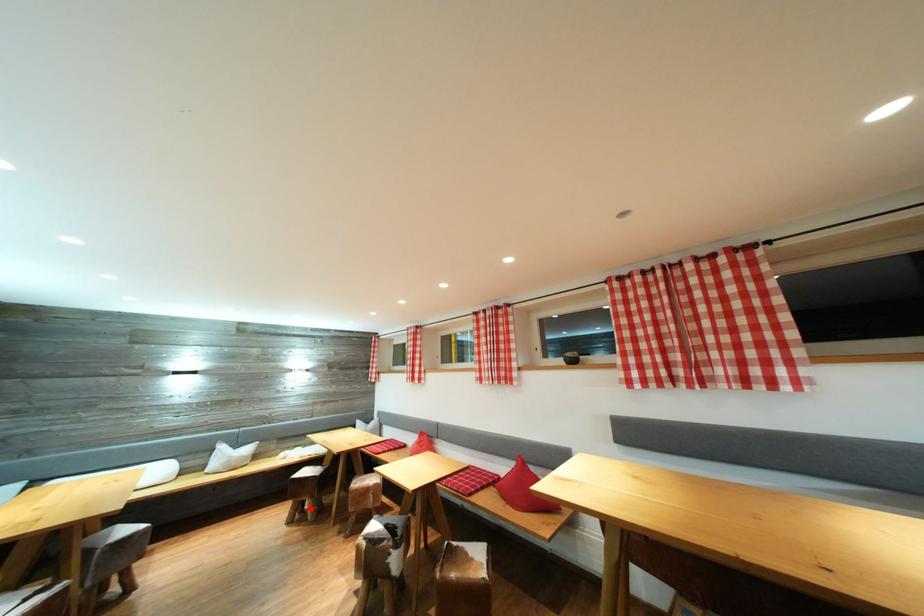
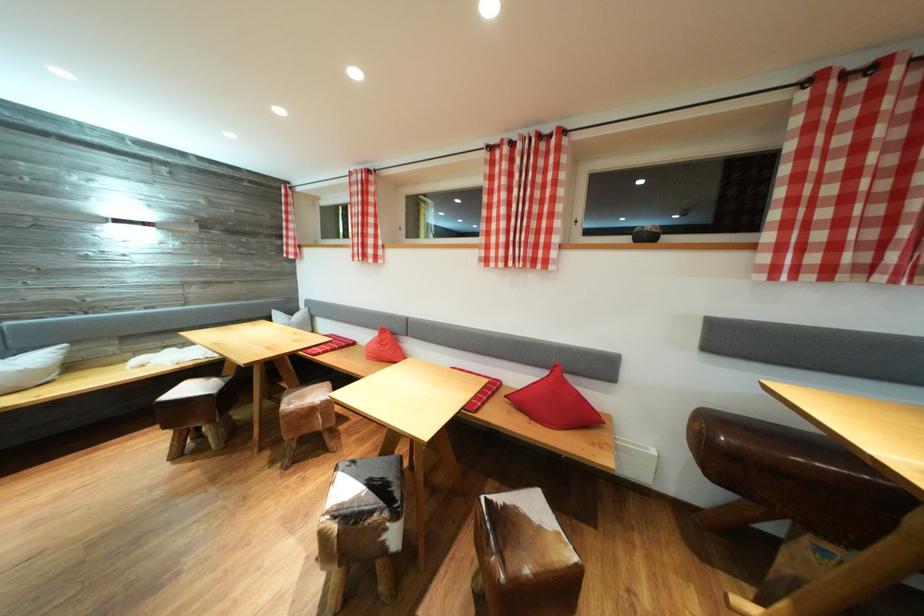
Where in the second image is the point corresponding to the highlighted location from the first image?

(203, 434)